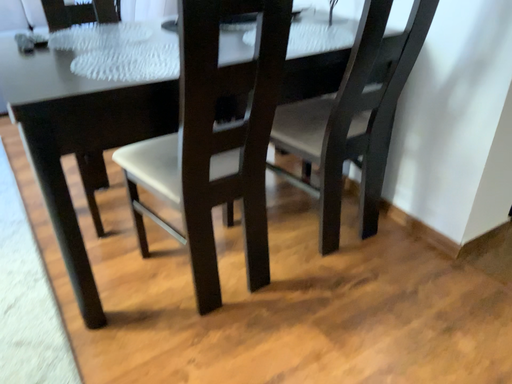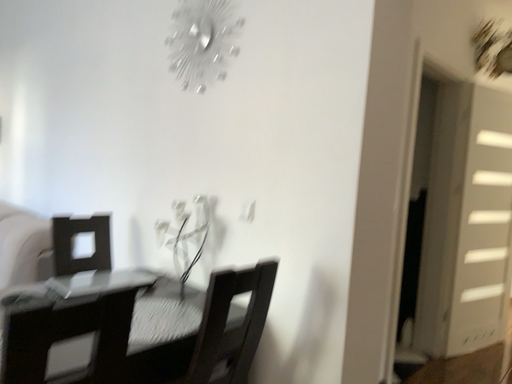
Question: Which way did the camera rotate in the video?

Choices:
 (A) rotated left
 (B) rotated right

Answer: (B)